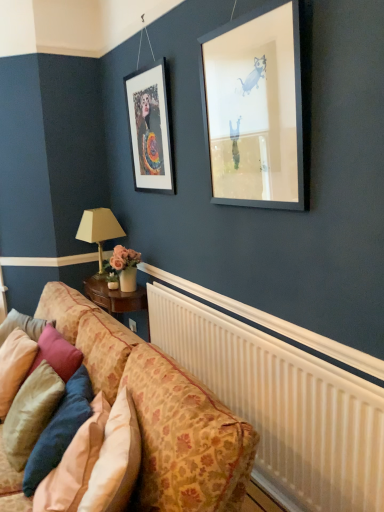
Question: Considering the relative positions of patterned fabric couch at lower left and velvet pink pillow at lower left, marked as the 2th pillow in a right-to-left arrangement, in the image provided, is patterned fabric couch at lower left to the left of velvet pink pillow at lower left, marked as the 2th pillow in a right-to-left arrangement, from the viewer's perspective?

Choices:
 (A) no
 (B) yes

Answer: (A)

Question: Considering the relative sizes of patterned fabric couch at lower left and velvet pink pillow at lower left, the 2th pillow when ordered from left to right, in the image provided, is patterned fabric couch at lower left taller than velvet pink pillow at lower left, the 2th pillow when ordered from left to right,?

Choices:
 (A) yes
 (B) no

Answer: (A)

Question: Is the position of patterned fabric couch at lower left less distant than that of velvet pink pillow at lower left, the 2th pillow when ordered from left to right?

Choices:
 (A) yes
 (B) no

Answer: (A)

Question: Considering the relative sizes of patterned fabric couch at lower left and velvet pink pillow at lower left, the 2th pillow when ordered from left to right, in the image provided, is patterned fabric couch at lower left wider than velvet pink pillow at lower left, the 2th pillow when ordered from left to right,?

Choices:
 (A) no
 (B) yes

Answer: (B)

Question: From a real-world perspective, is patterned fabric couch at lower left over velvet pink pillow at lower left, the 2th pillow when ordered from left to right?

Choices:
 (A) yes
 (B) no

Answer: (B)

Question: Considering the positions of velvety blue pillow at lower left, arranged as the third pillow when viewed from the left, and white plastic radiator at lower right in the image, is velvety blue pillow at lower left, arranged as the third pillow when viewed from the left, wider or thinner than white plastic radiator at lower right?

Choices:
 (A) thin
 (B) wide

Answer: (B)

Question: From a real-world perspective, is velvety blue pillow at lower left, which ranks as the first pillow in right-to-left order, above or below white plastic radiator at lower right?

Choices:
 (A) above
 (B) below

Answer: (A)

Question: Considering the positions of point (44, 472) and point (329, 372), is point (44, 472) closer or farther from the camera than point (329, 372)?

Choices:
 (A) farther
 (B) closer

Answer: (B)

Question: From the image's perspective, is velvety blue pillow at lower left, which ranks as the first pillow in right-to-left order, above or below white plastic radiator at lower right?

Choices:
 (A) below
 (B) above

Answer: (A)

Question: Is point (8, 443) closer or farther from the camera than point (261, 456)?

Choices:
 (A) closer
 (B) farther

Answer: (A)

Question: Is velvet pink pillow at lower left, the 2th pillow when ordered from left to right, inside the boundaries of white plastic radiator at lower right, or outside?

Choices:
 (A) outside
 (B) inside

Answer: (A)

Question: Relative to white plastic radiator at lower right, is velvet pink pillow at lower left, marked as the 2th pillow in a right-to-left arrangement, in front or behind?

Choices:
 (A) front
 (B) behind

Answer: (B)

Question: In terms of size, does velvet pink pillow at lower left, marked as the 2th pillow in a right-to-left arrangement, appear bigger or smaller than white plastic radiator at lower right?

Choices:
 (A) big
 (B) small

Answer: (B)

Question: Considering the positions of matte black frame at upper left and velvet beige pillow at lower left, the third pillow when ordered from right to left, in the image, is matte black frame at upper left wider or thinner than velvet beige pillow at lower left, the third pillow when ordered from right to left,?

Choices:
 (A) thin
 (B) wide

Answer: (A)

Question: Is matte black frame at upper left in front of or behind velvet beige pillow at lower left, which is counted as the first pillow, starting from the left, in the image?

Choices:
 (A) behind
 (B) front

Answer: (A)